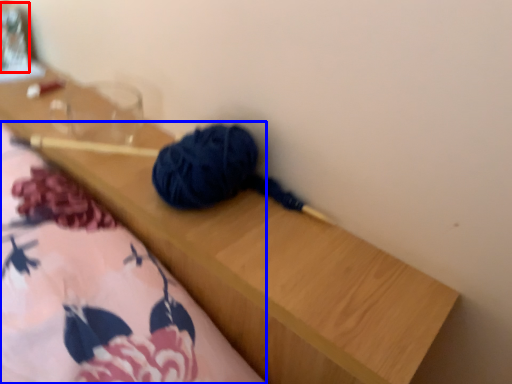
Question: Which object is closer to the camera taking this photo, glass jar (highlighted by a red box) or blanket (highlighted by a blue box)?

Choices:
 (A) glass jar
 (B) blanket

Answer: (B)